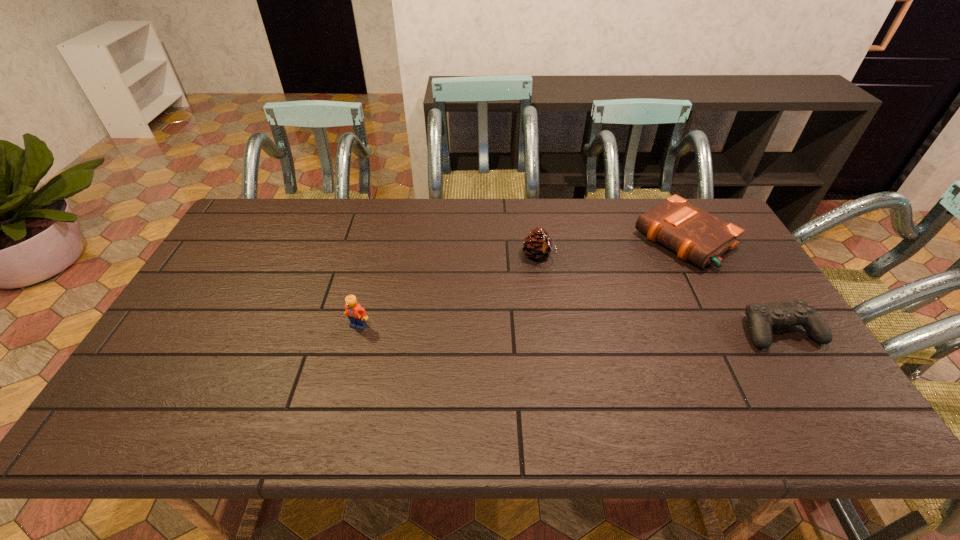
The width and height of the screenshot is (960, 540). Find the location of `vacant space situated 0.250m with a leaf charm attached to the third object from right to left`. vacant space situated 0.250m with a leaf charm attached to the third object from right to left is located at coordinates (595, 321).

Where is `free space located with a leaf charm attached to the third object from right to left`? The height and width of the screenshot is (540, 960). free space located with a leaf charm attached to the third object from right to left is located at coordinates (576, 299).

Image resolution: width=960 pixels, height=540 pixels. In order to click on object at the far edge in this screenshot , I will do `click(695, 235)`.

I want to click on control that is positioned at the right edge, so click(x=761, y=317).

Identify the location of Bible located in the right edge section of the desktop. coord(695,235).

This screenshot has height=540, width=960. Find the location of `object present at the far right corner`. object present at the far right corner is located at coordinates (695, 235).

In the image, there is a desktop. Where is `vacant space at the far edge`? The image size is (960, 540). vacant space at the far edge is located at coordinates (392, 235).

Find the location of a particular element. The image size is (960, 540). vacant space at the near edge of the desktop is located at coordinates (293, 387).

This screenshot has width=960, height=540. Find the location of `free space at the left edge`. free space at the left edge is located at coordinates (206, 329).

In the image, there is a desktop. Identify the location of free space at the right edge. (739, 314).